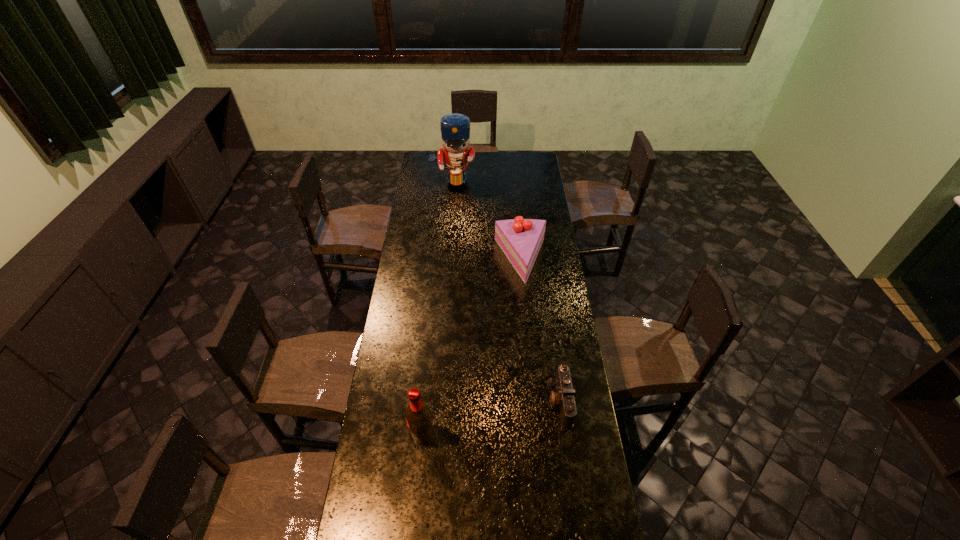
Identify the location of free space between the third shortest object and the third nearest object. (471, 347).

The width and height of the screenshot is (960, 540). Find the location of `vacant space in between the camera and the nutcracker`. vacant space in between the camera and the nutcracker is located at coordinates (506, 291).

Locate an element on the screen. The image size is (960, 540). empty location between the tallest object and the third shortest object is located at coordinates (438, 307).

Identify the location of free space between the farthest object and the third shortest object. (438, 307).

The width and height of the screenshot is (960, 540). What are the coordinates of `vacant space in between the third shortest object and the camera` in the screenshot? It's located at (491, 418).

Find the location of `vacant area that lies between the cake and the third shortest object`. vacant area that lies between the cake and the third shortest object is located at coordinates (471, 347).

I want to click on empty space that is in between the shortest object and the third shortest object, so click(491, 418).

Where is `free space between the second tallest object and the second shortest object`? The width and height of the screenshot is (960, 540). free space between the second tallest object and the second shortest object is located at coordinates (471, 347).

The image size is (960, 540). I want to click on empty space that is in between the nutcracker and the shortest object, so click(x=506, y=291).

This screenshot has height=540, width=960. Find the location of `vacant space that is in between the third nearest object and the third shortest object`. vacant space that is in between the third nearest object and the third shortest object is located at coordinates (471, 347).